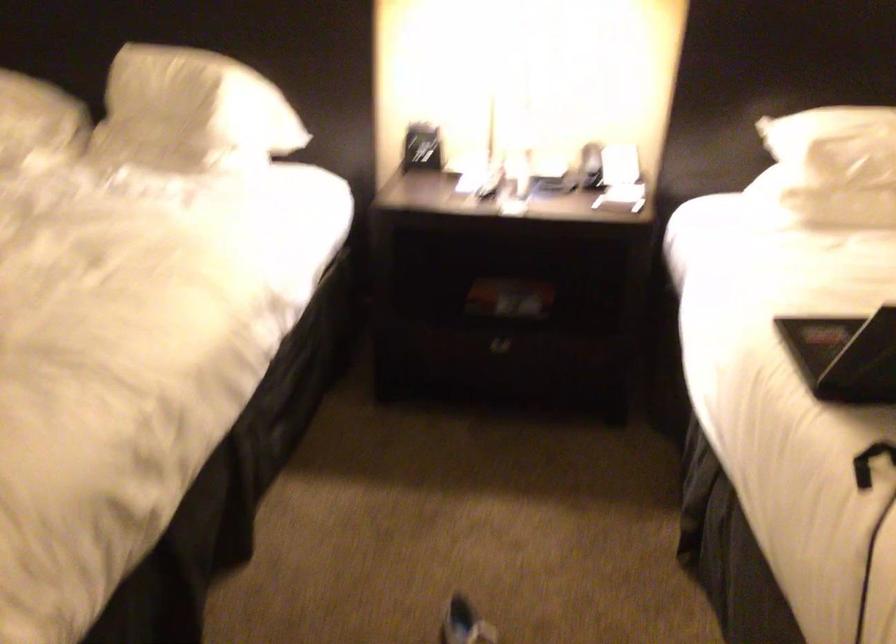
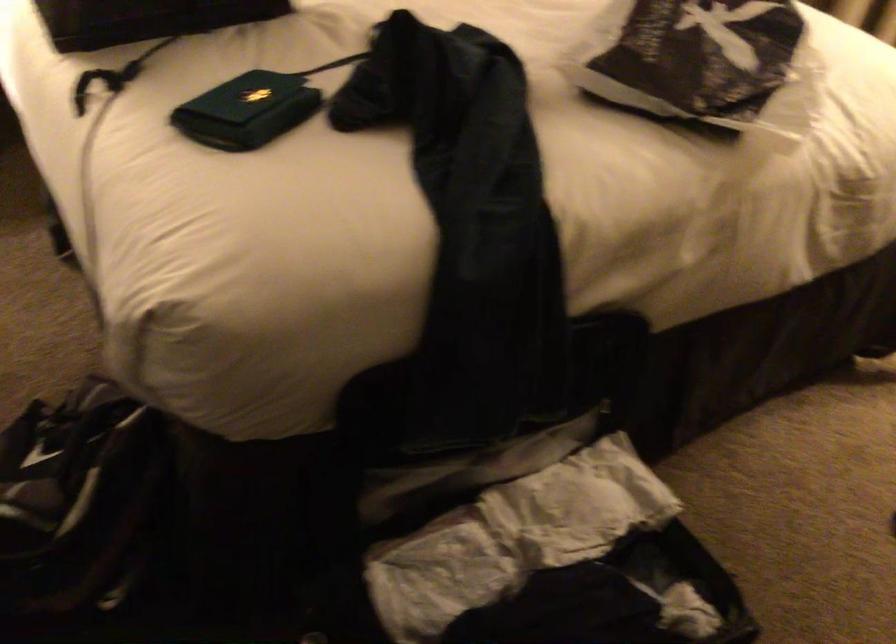
The images are taken continuously from a first-person perspective. In which direction is your viewpoint rotating?

The rotation direction of the camera is right-down.